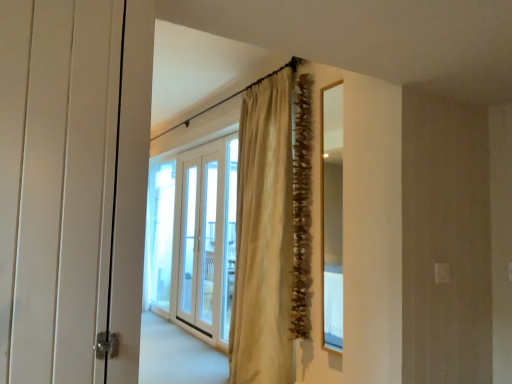
I want to click on beige textured curtain at upper center, so click(263, 237).

This screenshot has width=512, height=384. Describe the element at coordinates (263, 237) in the screenshot. I see `beige textured curtain at upper center` at that location.

Identify the location of beige textured curtain at upper center. This screenshot has height=384, width=512. (263, 237).